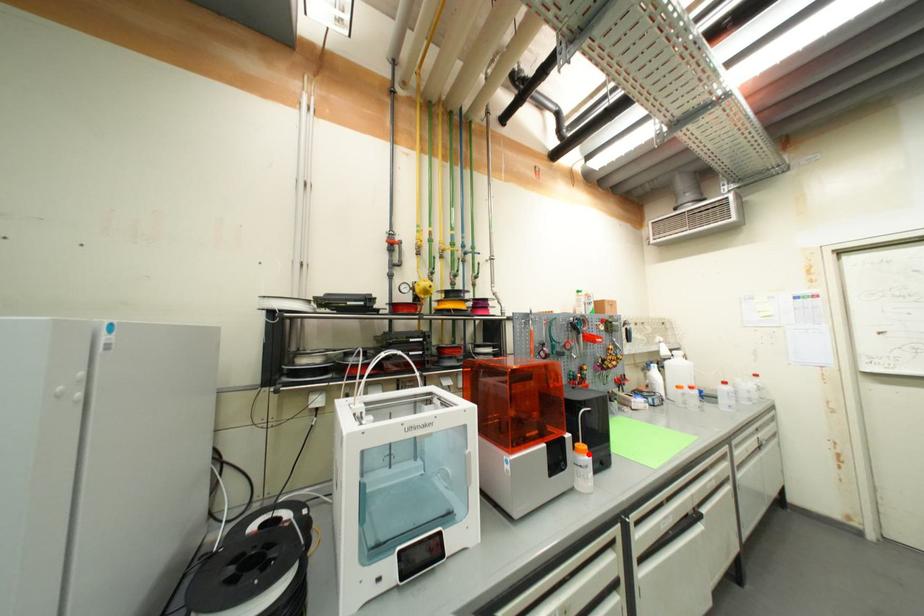
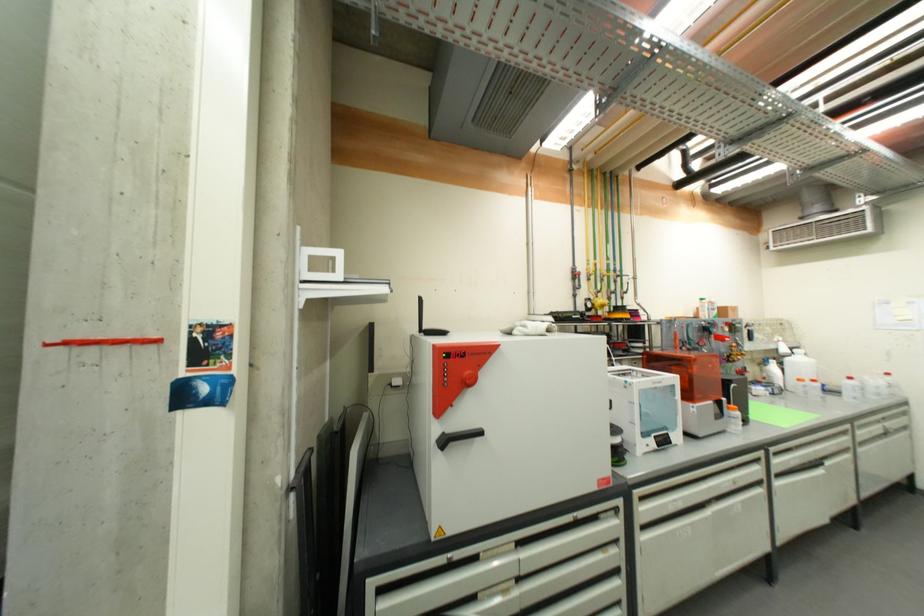
Locate, in the second image, the point that corresponds to the highlighted location in the first image.

(739, 411)